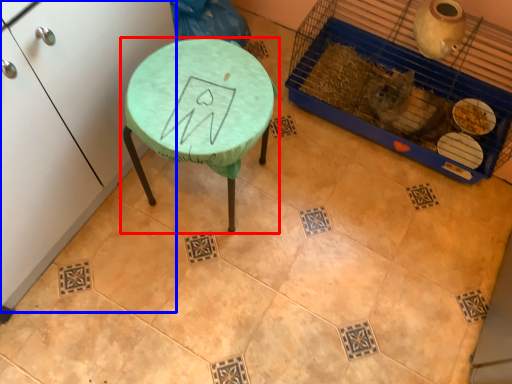
Question: Which point is further to the camera, table (highlighted by a red box) or furniture (highlighted by a blue box)?

Choices:
 (A) table
 (B) furniture

Answer: (A)